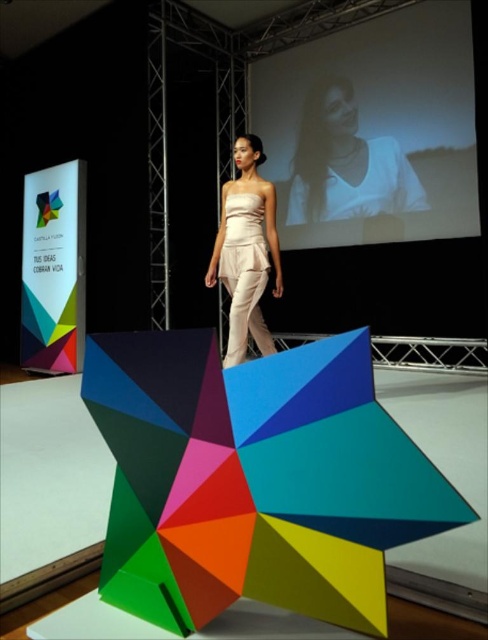
You are a photographer at the fashion show. You need to capture a shot where the model is centered between the vertical banner on the left and the large screen on the right. Is the point marked at coordinates point (345, 163) the correct position to focus on for this composition?

The point (345, 163) marks the white matte shirt at upper center, so yes, focusing on that point would center the model between the vertical banner on the left and the large screen on the right.

You are standing at the runway entrance and want to know how far the point at coordinates point (349, 182) is from you. Can you determine the distance?

The distance of point (349, 182) from viewer is 6.27 meters.

You are a photographer at the fashion show. You need to capture a photo where both the white matte shirt at upper center and the matte white dress at center are visible. Which one should you focus on to ensure both are in frame without cropping?

To ensure both the white matte shirt at upper center and the matte white dress at center are visible without cropping, focus on the white matte shirt at upper center since it is larger and can serve as a central point while the smaller matte white dress at center remains in view.